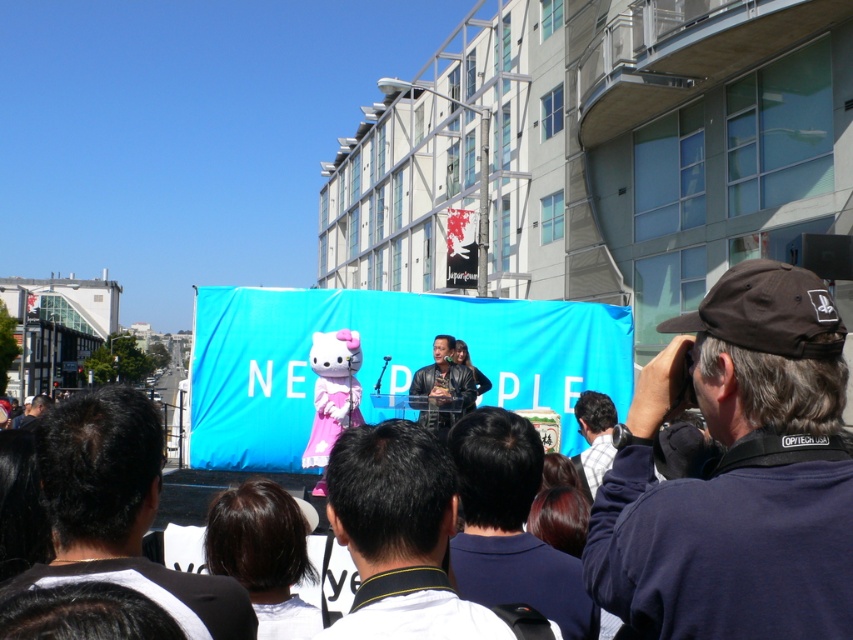
Is point (723, 385) positioned in front of point (418, 428)?

Yes, point (723, 385) is in front of point (418, 428).

Between black fabric cap at upper right and white shirt at center, which one has more height?

black fabric cap at upper right

The image size is (853, 640). Identify the location of black fabric cap at upper right. (737, 474).

Which is above, white shirt at center or dark blue shirt at center?

white shirt at center is higher up.

Is white shirt at center below dark blue shirt at center?

Incorrect, white shirt at center is not positioned below dark blue shirt at center.

Is point (343, 540) positioned behind point (567, 625)?

No, it is in front of (567, 625).

Identify the location of white shirt at center. This screenshot has height=640, width=853. (x=399, y=536).

Which of these two, black fabric cap at upper right or dark blue shirt at center, stands shorter?

dark blue shirt at center

Consider the image. Can you confirm if black fabric cap at upper right is positioned to the right of dark blue shirt at center?

Indeed, black fabric cap at upper right is positioned on the right side of dark blue shirt at center.

Does point (785, 534) come closer to viewer compared to point (566, 620)?

Yes, point (785, 534) is closer to viewer.

The height and width of the screenshot is (640, 853). In order to click on black fabric cap at upper right in this screenshot , I will do `click(737, 474)`.